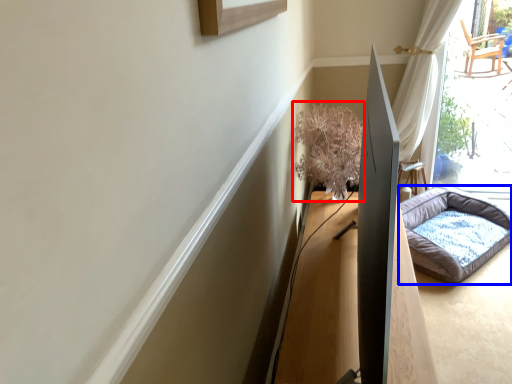
Question: Which point is closer to the camera, plant (highlighted by a red box) or dog bed (highlighted by a blue box)?

Choices:
 (A) plant
 (B) dog bed

Answer: (A)